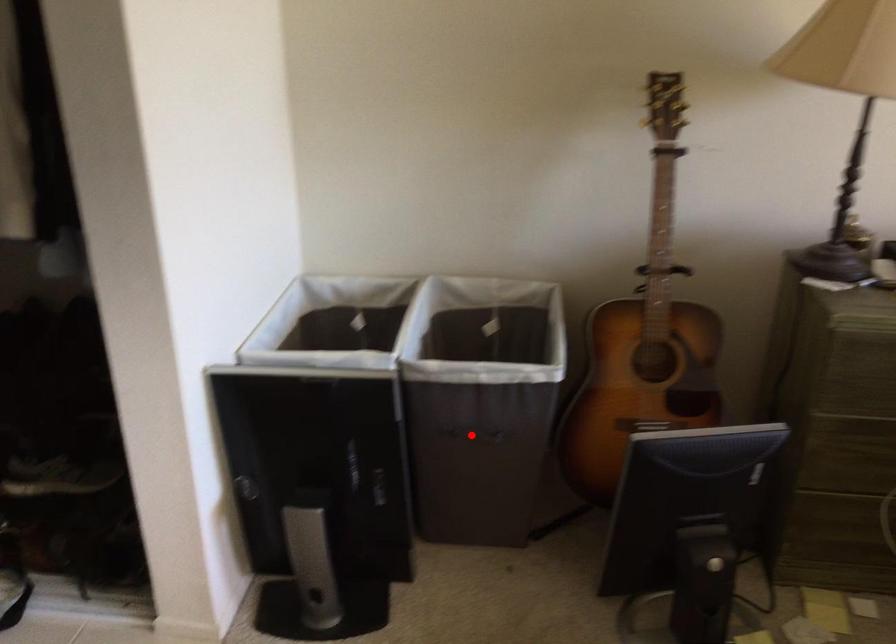
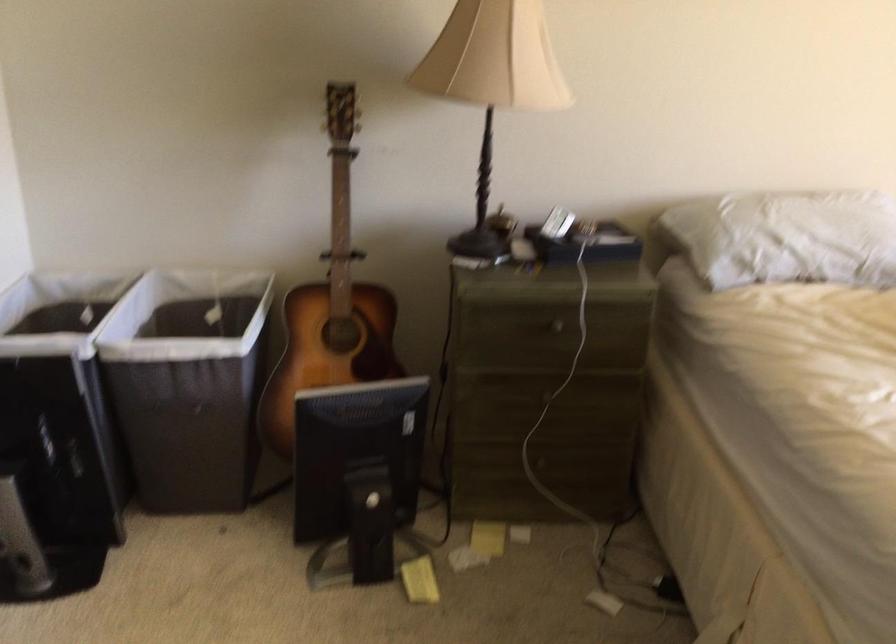
The point at the highlighted location is marked in the first image. Where is the corresponding point in the second image?

(181, 406)